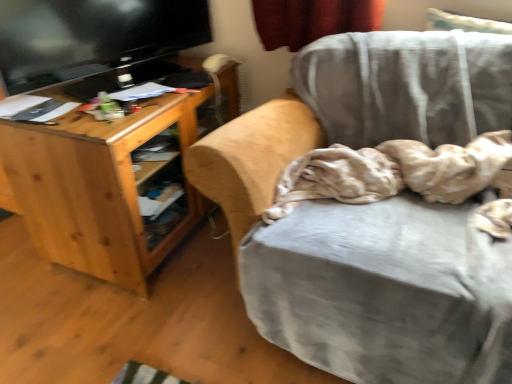
Measure the distance between black glossy television at upper left and camera.

black glossy television at upper left is 4.71 feet away from camera.

In order to face black glossy television at upper left, should I rotate leftwards or rightwards?

You should rotate left by 17.144 degrees.

You are a GUI agent. You are given a task and a screenshot of the screen. Output one action in this format:
    pyautogui.click(x=<x>, y=<y>)
    Task: Click on the velvet gray chair at center
    The image size is (512, 384).
    Given the screenshot: What is the action you would take?
    pyautogui.click(x=358, y=108)

Describe the element at coordinates (98, 188) in the screenshot. I see `natural wood desk at left` at that location.

I want to click on natural wood desk at left, so click(98, 188).

The height and width of the screenshot is (384, 512). I want to click on black glossy television at upper left, so click(92, 36).

From the image's perspective, is natural wood desk at left above velvet gray chair at center?

Yes, from the image's perspective, natural wood desk at left is on top of velvet gray chair at center.

Considering the positions of points (39, 206) and (471, 94), is point (39, 206) farther from camera compared to point (471, 94)?

Yes, point (39, 206) is behind point (471, 94).

Is velvet gray chair at center at the back of natural wood desk at left?

No, natural wood desk at left's orientation is not away from velvet gray chair at center.

Is velvet gray chair at center oriented away from beige soft fabric at center?

Yes, beige soft fabric at center is at the back of velvet gray chair at center.

From a real-world perspective, does velvet gray chair at center stand above beige soft fabric at center?

No, from a real-world perspective, velvet gray chair at center is not on top of beige soft fabric at center.

Considering the relative sizes of velvet gray chair at center and beige soft fabric at center in the image provided, is velvet gray chair at center thinner than beige soft fabric at center?

Incorrect, the width of velvet gray chair at center is not less than that of beige soft fabric at center.

Considering the sizes of objects velvet gray chair at center and beige soft fabric at center in the image provided, who is smaller, velvet gray chair at center or beige soft fabric at center?

beige soft fabric at center.

Is natural wood desk at left looking in the opposite direction of beige soft fabric at center?

No, natural wood desk at left is not facing the opposite direction of beige soft fabric at center.

Considering their positions, is natural wood desk at left located in front of or behind beige soft fabric at center?

Clearly, natural wood desk at left is behind beige soft fabric at center.

Considering the points (197, 96) and (422, 144), which point is in front, point (197, 96) or point (422, 144)?

Positioned in front is point (422, 144).

Looking at this image, from a real-world perspective, relative to beige soft fabric at center, is natural wood desk at left vertically above or below?

Clearly, from a real-world perspective, natural wood desk at left is below beige soft fabric at center.

From the image's perspective, is beige soft fabric at center under velvet gray chair at center?

Actually, beige soft fabric at center appears above velvet gray chair at center in the image.

Which object is closer to the camera taking this photo, beige soft fabric at center or velvet gray chair at center?

velvet gray chair at center is in front.

Which of these two, beige soft fabric at center or velvet gray chair at center, stands taller?

velvet gray chair at center.

Does beige soft fabric at center turn towards velvet gray chair at center?

Yes, beige soft fabric at center is turned towards velvet gray chair at center.

Is black glossy television at upper left to the left or to the right of velvet gray chair at center in the image?

black glossy television at upper left is to the left of velvet gray chair at center.

Between black glossy television at upper left and velvet gray chair at center, which one is positioned in front?

velvet gray chair at center is closer to the camera.

Who is shorter, black glossy television at upper left or velvet gray chair at center?

Standing shorter between the two is black glossy television at upper left.

From a real-world perspective, which object stands above the other?

beige soft fabric at center, from a real-world perspective.

Is beige soft fabric at center bigger or smaller than natural wood desk at left?

beige soft fabric at center is smaller than natural wood desk at left.

Which is more to the left, beige soft fabric at center or natural wood desk at left?

natural wood desk at left.

This screenshot has height=384, width=512. I want to click on blanket lying in front of the natural wood desk at left, so click(392, 172).

Are velvet gray chair at center and natural wood desk at left making contact?

velvet gray chair at center is not next to natural wood desk at left, and they're not touching.

Can you confirm if velvet gray chair at center is smaller than natural wood desk at left?

Actually, velvet gray chair at center might be larger than natural wood desk at left.

Does point (419, 365) come closer to viewer compared to point (76, 116)?

Yes, point (419, 365) is in front of point (76, 116).

This screenshot has width=512, height=384. Find the location of `desk on the left of the velvet gray chair at center`. desk on the left of the velvet gray chair at center is located at coordinates (98, 188).

Find the location of a particular element. blanket above the velvet gray chair at center (from a real-world perspective) is located at coordinates (392, 172).

In the scene shown: Considering their positions, is natural wood desk at left positioned closer to beige soft fabric at center than black glossy television at upper left?

natural wood desk at left.

From the picture: Estimate the real-world distances between objects in this image. Which object is closer to natural wood desk at left, velvet gray chair at center or black glossy television at upper left?

black glossy television at upper left lies closer to natural wood desk at left than the other object.

Based on their spatial positions, is black glossy television at upper left or natural wood desk at left closer to beige soft fabric at center?

Among the two, natural wood desk at left is located nearer to beige soft fabric at center.

Which object lies further to the anchor point velvet gray chair at center, black glossy television at upper left or beige soft fabric at center?

Based on the image, black glossy television at upper left appears to be further to velvet gray chair at center.

Considering their positions, is velvet gray chair at center positioned further to black glossy television at upper left than natural wood desk at left?

velvet gray chair at center is further to black glossy television at upper left.

When comparing their distances from black glossy television at upper left, does beige soft fabric at center or natural wood desk at left seem closer?

natural wood desk at left is positioned closer to the anchor black glossy television at upper left.

Based on their spatial positions, is natural wood desk at left or velvet gray chair at center further from beige soft fabric at center?

Based on the image, natural wood desk at left appears to be further to beige soft fabric at center.

Based on their spatial positions, is velvet gray chair at center or natural wood desk at left closer to beige soft fabric at center?

velvet gray chair at center lies closer to beige soft fabric at center than the other object.

Locate an element on the screen. The width and height of the screenshot is (512, 384). chair located between black glossy television at upper left and beige soft fabric at center in the left-right direction is located at coordinates (358, 108).

Locate an element on the screen. Image resolution: width=512 pixels, height=384 pixels. television between natural wood desk at left and velvet gray chair at center is located at coordinates (92, 36).

Where is `television between natural wood desk at left and beige soft fabric at center`? The width and height of the screenshot is (512, 384). television between natural wood desk at left and beige soft fabric at center is located at coordinates (92, 36).

Where is `chair situated between natural wood desk at left and beige soft fabric at center from left to right`? chair situated between natural wood desk at left and beige soft fabric at center from left to right is located at coordinates (358, 108).